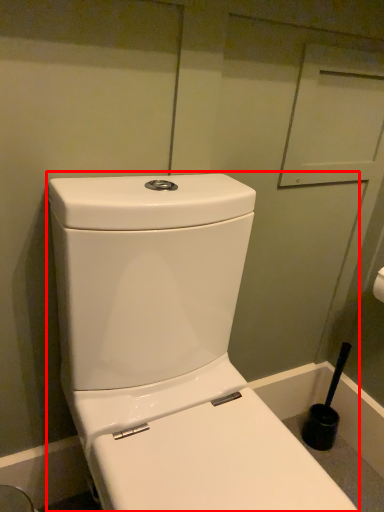
Question: From the image, what is the correct spatial relationship of toilet (annotated by the red box) in relation to brush?

Choices:
 (A) left
 (B) right

Answer: (A)